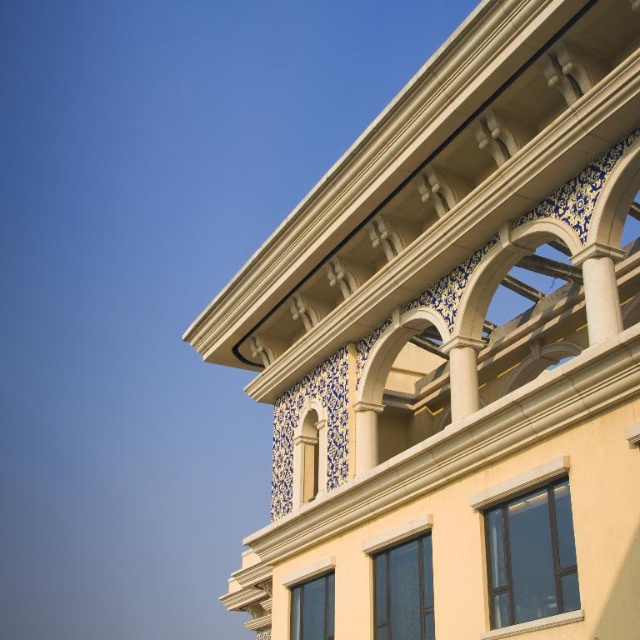
You are standing in front of the building and notice two points marked on its facade. The first point is at coordinates point (493, 465) and the second is at point (308, 464). Which point is physically closer to your eyes?

Point (493, 465) is closer to the viewer than point (308, 464).

Consider the image. You are an architect designing a new building and want to ensure proper spacing between the matte glass window at lower right and the matte glass window at center. According to the design specifications, the minimum required distance between any two windows is 10 meters. Based on the image provided, does the current spacing between these two windows meet the requirement?

The matte glass window at lower right and matte glass window at center are 11.35 meters apart from each other. Since 11.35 meters is greater than the minimum required 10 meters, the spacing between them meets the requirement.

You are standing in front of the building shown in the image. You want to know if you can reach the matte glass window at lower right by throwing a small ball. The ball can travel a maximum distance of 20 meters. Can you reach it?

The matte glass window at lower right is 23.51 meters away from the viewer, which is beyond the ball travel distance of 20 meters. Therefore, you cannot reach the matte glass window at lower right by throwing the ball.